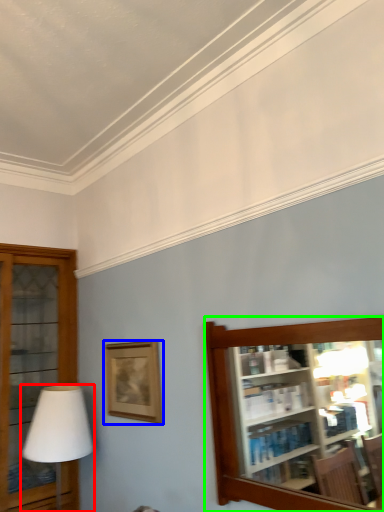
Question: Considering the real-world distances, which object is farthest from table lamp (highlighted by a red box)? picture frame (highlighted by a blue box) or shelf (highlighted by a green box)?

Choices:
 (A) picture frame
 (B) shelf

Answer: (B)